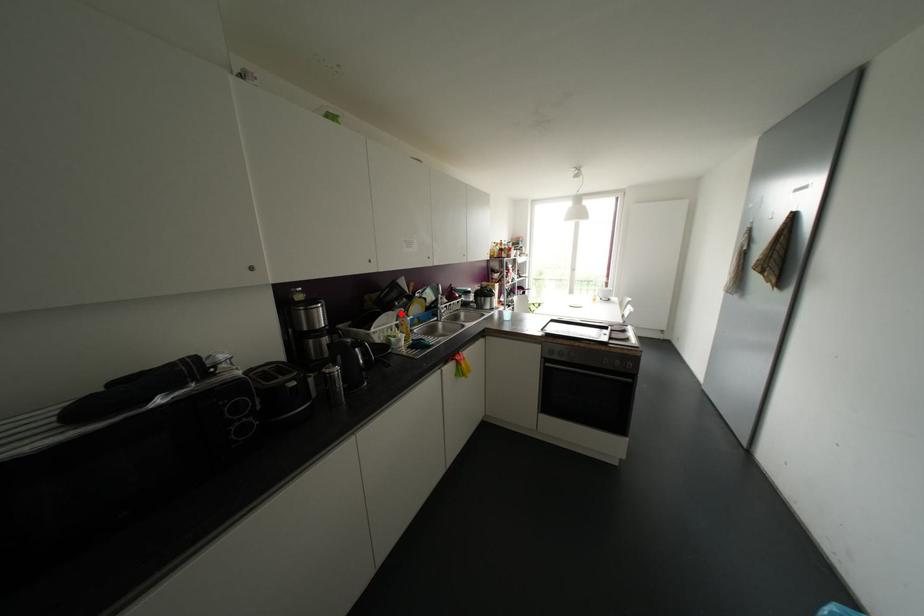
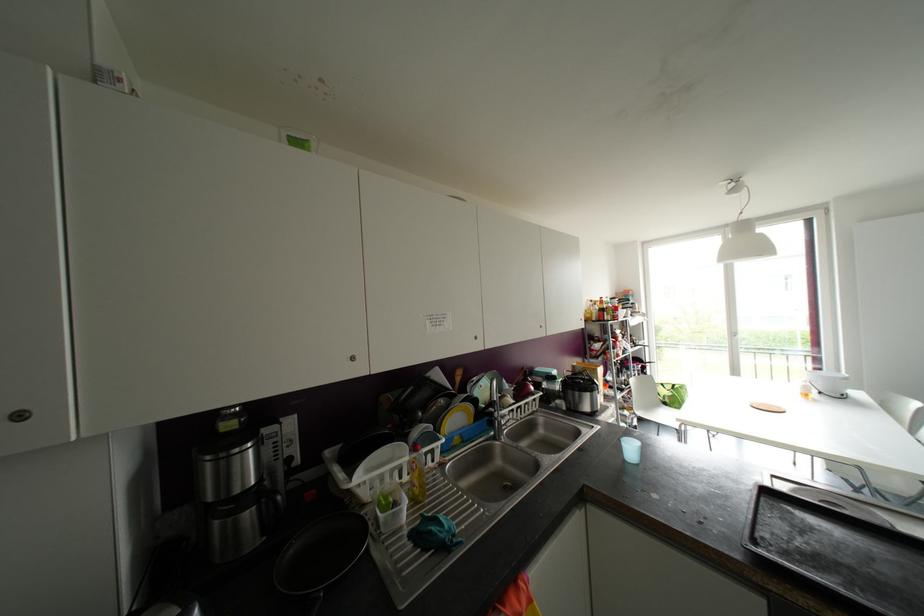
In the second image, find the point that corresponds to the highlighted location in the first image.

(414, 448)